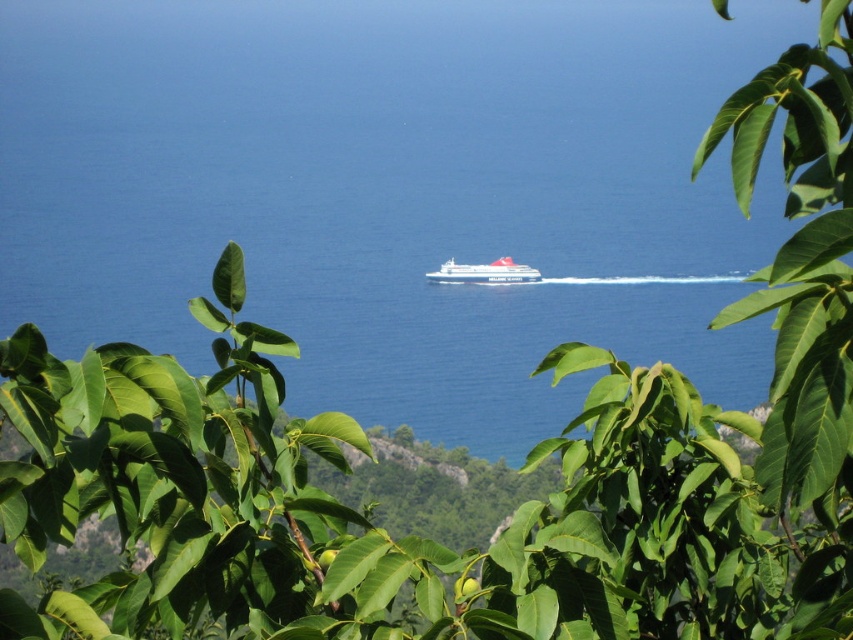
Can you confirm if blue liquid water at center is shorter than white glossy ferry at center?

No.

Between point (641, 131) and point (463, 275), which one is positioned in front?

Point (463, 275) is more forward.

Where is `blue liquid water at center`? The width and height of the screenshot is (853, 640). blue liquid water at center is located at coordinates (392, 192).